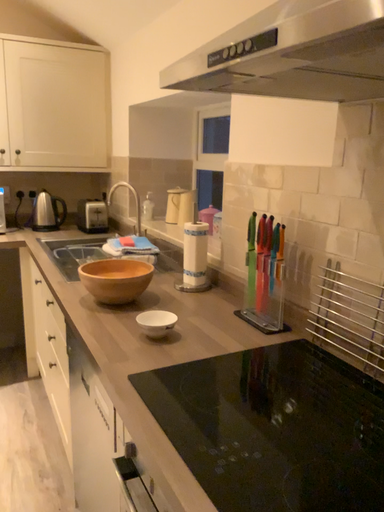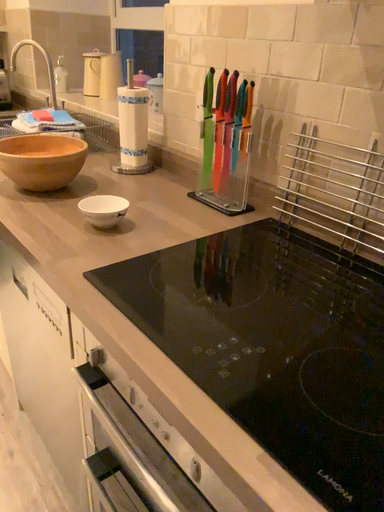
Question: Which way did the camera rotate in the video?

Choices:
 (A) rotated downward
 (B) rotated upward

Answer: (A)